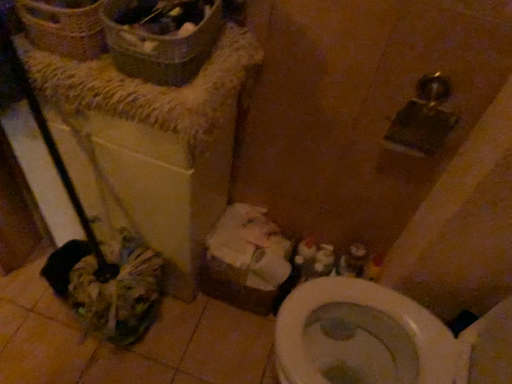
Question: From a real-world perspective, is woven brown basket at upper left above or below white cardboard box at lower center?

Choices:
 (A) above
 (B) below

Answer: (A)

Question: In the image, is woven brown basket at upper left positioned in front of or behind white cardboard box at lower center?

Choices:
 (A) behind
 (B) front

Answer: (B)

Question: Would you say woven brown basket at upper left is to the left or to the right of white cardboard box at lower center in the picture?

Choices:
 (A) left
 (B) right

Answer: (A)

Question: Considering the positions of white cardboard box at lower center and woven brown basket at upper left in the image, is white cardboard box at lower center wider or thinner than woven brown basket at upper left?

Choices:
 (A) wide
 (B) thin

Answer: (A)

Question: Considering the positions of white cardboard box at lower center and woven brown basket at upper left in the image, is white cardboard box at lower center taller or shorter than woven brown basket at upper left?

Choices:
 (A) short
 (B) tall

Answer: (B)

Question: Relative to woven brown basket at upper left, is white cardboard box at lower center in front or behind?

Choices:
 (A) front
 (B) behind

Answer: (B)

Question: Does point (212, 253) appear closer or farther from the camera than point (50, 26)?

Choices:
 (A) closer
 (B) farther

Answer: (B)